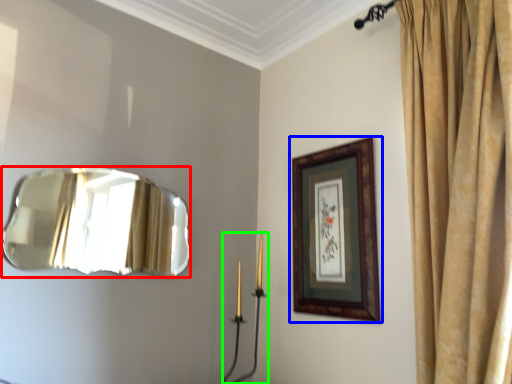
Question: Considering the real-world distances, which object is farthest from mirror (highlighted by a red box)? picture frame (highlighted by a blue box) or candle holder (highlighted by a green box)?

Choices:
 (A) picture frame
 (B) candle holder

Answer: (A)